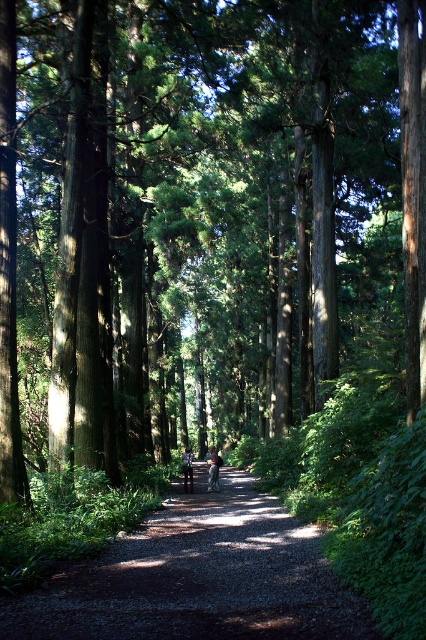
Question: Is brown leather jacket at center to the right of light brown leather jacket at center from the viewer's perspective?

Choices:
 (A) no
 (B) yes

Answer: (B)

Question: Among these points, which one is farthest from the camera?

Choices:
 (A) (184, 476)
 (B) (219, 461)

Answer: (B)

Question: Observing the image, what is the correct spatial positioning of dirt/gravel path at center in reference to light brown leather jacket at center?

Choices:
 (A) below
 (B) above

Answer: (B)

Question: Does brown leather jacket at center appear over light brown leather jacket at center?

Choices:
 (A) no
 (B) yes

Answer: (B)

Question: Which point is farther to the camera?

Choices:
 (A) dirt/gravel path at center
 (B) brown leather jacket at center
 (C) light brown leather jacket at center

Answer: (B)

Question: Estimate the real-world distances between objects in this image. Which object is farther from the light brown leather jacket at center?

Choices:
 (A) brown leather jacket at center
 (B) dirt/gravel path at center

Answer: (B)